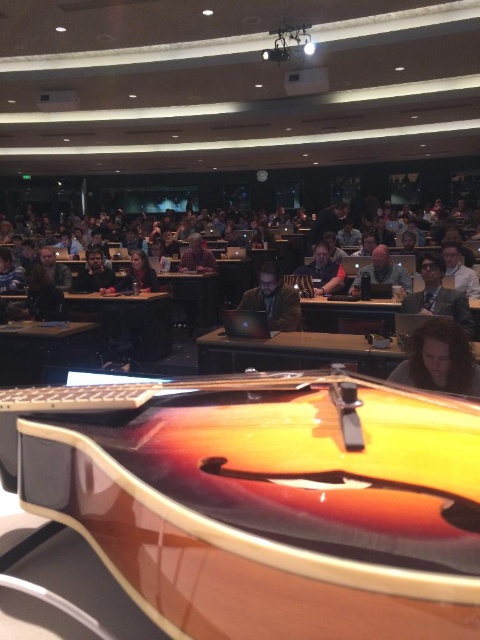
The width and height of the screenshot is (480, 640). In order to click on brown wood table at center in this screenshot , I will do `click(294, 353)`.

Is point (292, 369) farther from camera compared to point (59, 282)?

No, it is not.

Where is `brown wood table at center`? brown wood table at center is located at coordinates (294, 353).

You are a GUI agent. You are given a task and a screenshot of the screen. Output one action in this format:
    pyautogui.click(x=<x>, y=<y>)
    Task: Click on the brown wood table at center
    This screenshot has width=480, height=640.
    Given the screenshot: What is the action you would take?
    pyautogui.click(x=294, y=353)

Is dark brown wood guitar at lower right wider than matte brown shirt at center?

No, dark brown wood guitar at lower right is not wider than matte brown shirt at center.

Is point (409, 385) closer to camera compared to point (214, 259)?

Yes.

Find the location of `dark brown wood guitar at lower right`. dark brown wood guitar at lower right is located at coordinates (440, 358).

In the scene shown: Can you confirm if matte brown jacket at center is positioned above matte brown guitar at center?

No.

Which is more to the left, matte brown jacket at center or matte brown guitar at center?

Positioned to the left is matte brown jacket at center.

This screenshot has height=640, width=480. Identify the location of matte brown jacket at center. (274, 300).

At what (x,y) coordinates should I click in order to perform the action: click on matte brown jacket at center. Please return your answer as a coordinate pair (x, y). The height and width of the screenshot is (640, 480). Looking at the image, I should click on (274, 300).